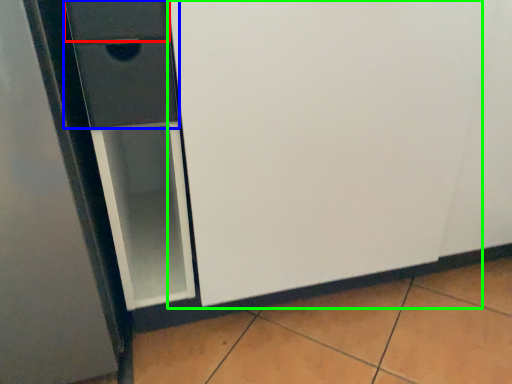
Question: Which object is positioned closest to drawer (highlighted by a red box)? Select from drawer (highlighted by a blue box) and screen door (highlighted by a green box).

Choices:
 (A) drawer
 (B) screen door

Answer: (A)